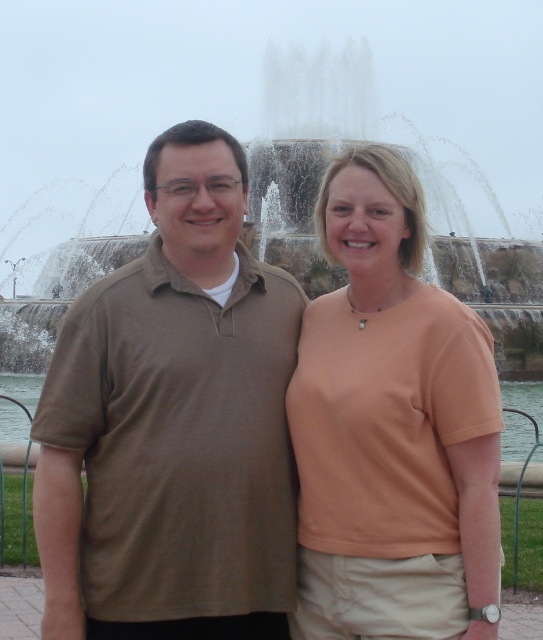
You are a photographer trying to capture the two people in the scene. The matte peach shirt at center and the stone water at center are both in your camera frame. Which object appears narrower in your photo?

The matte peach shirt at center has a lesser width compared to the stone water at center, so it appears narrower in the photo.

You are a photographer trying to capture both the brown cotton shirt at center and the matte peach shirt at center in a single frame. Since the camera has a limited focus range, you need to know which shirt is bigger to adjust the focus. Which shirt should you focus on first?

The brown cotton shirt at center is larger in size than the matte peach shirt at center, so you should focus on the brown cotton shirt at center first to ensure it is in clear view.